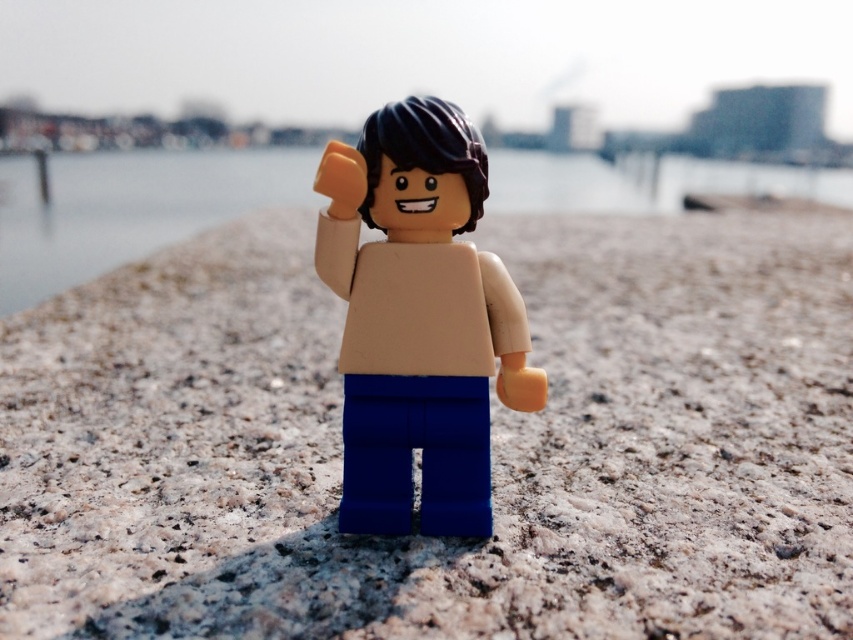
Who is higher up, matte plastic minifigure at center or clear water at center?

Positioned higher is clear water at center.

Who is lower down, matte plastic minifigure at center or clear water at center?

matte plastic minifigure at center is lower down.

Which is behind, point (389, 468) or point (749, 177)?

Point (749, 177)

Identify the location of matte plastic minifigure at center. The width and height of the screenshot is (853, 640). (418, 321).

In the scene shown: Measure the distance between point (680, 403) and camera.

Point (680, 403) is 5.11 feet away from camera.

Can you confirm if smooth sand at center is positioned above clear water at center?

Actually, smooth sand at center is below clear water at center.

Which is in front, point (578, 513) or point (256, 195)?

Point (578, 513) is more forward.

Find the location of a particular element. This screenshot has height=640, width=853. smooth sand at center is located at coordinates (491, 444).

Which is more to the right, smooth sand at center or matte plastic minifigure at center?

smooth sand at center

Does smooth sand at center appear under matte plastic minifigure at center?

No, smooth sand at center is not below matte plastic minifigure at center.

At what (x,y) coordinates should I click in order to perform the action: click on smooth sand at center. Please return your answer as a coordinate pair (x, y). This screenshot has width=853, height=640. Looking at the image, I should click on (491, 444).

Where is `smooth sand at center`? The image size is (853, 640). smooth sand at center is located at coordinates (491, 444).